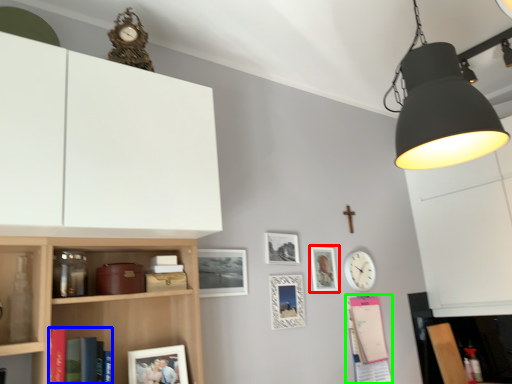
Question: Which object is the farthest from picture frame (highlighted by a red box)? Choose among these: book (highlighted by a blue box) or book (highlighted by a green box).

Choices:
 (A) book
 (B) book

Answer: (A)